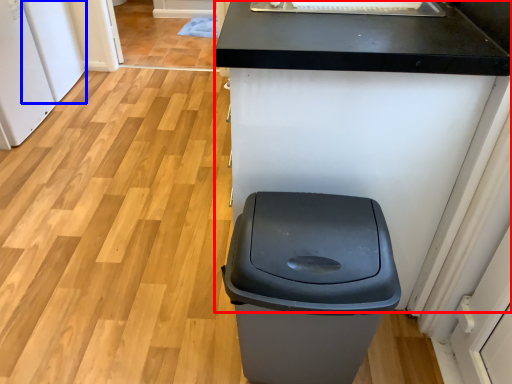
Question: Which object appears farthest to the camera in this image, counter (highlighted by a red box) or appliance (highlighted by a blue box)?

Choices:
 (A) counter
 (B) appliance

Answer: (B)